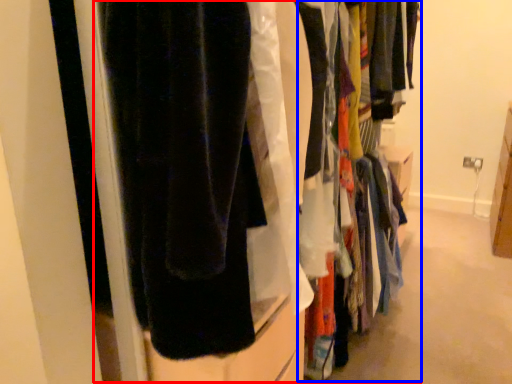
Question: Which of the following is the closest to the observer, closet (highlighted by a red box) or closet (highlighted by a blue box)?

Choices:
 (A) closet
 (B) closet

Answer: (A)